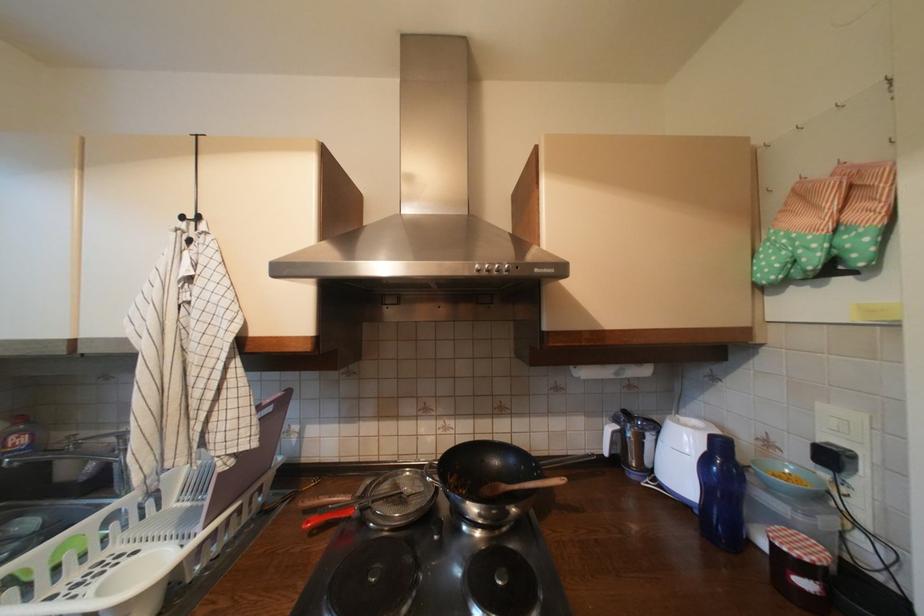
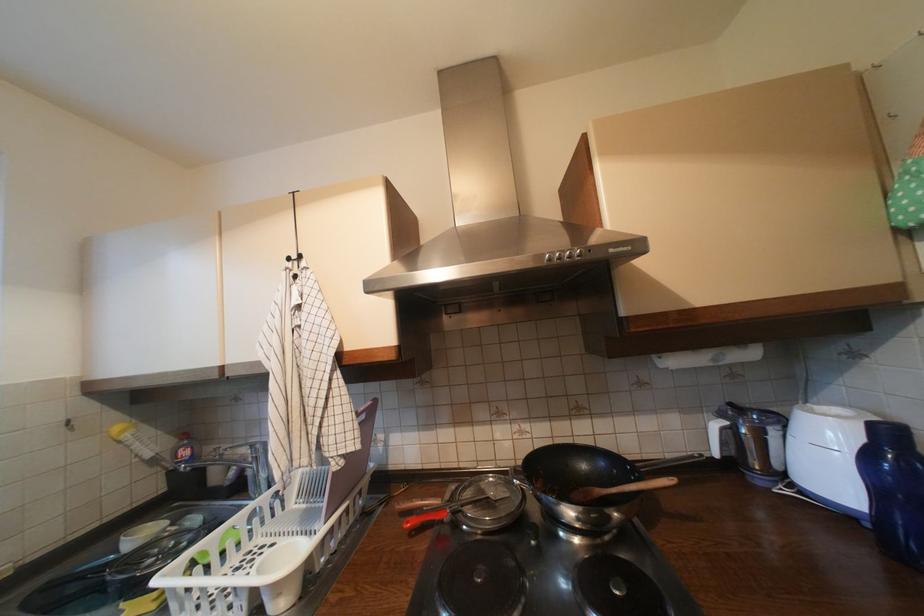
The point at (626, 429) is marked in the first image. Where is the corresponding point in the second image?

(735, 424)